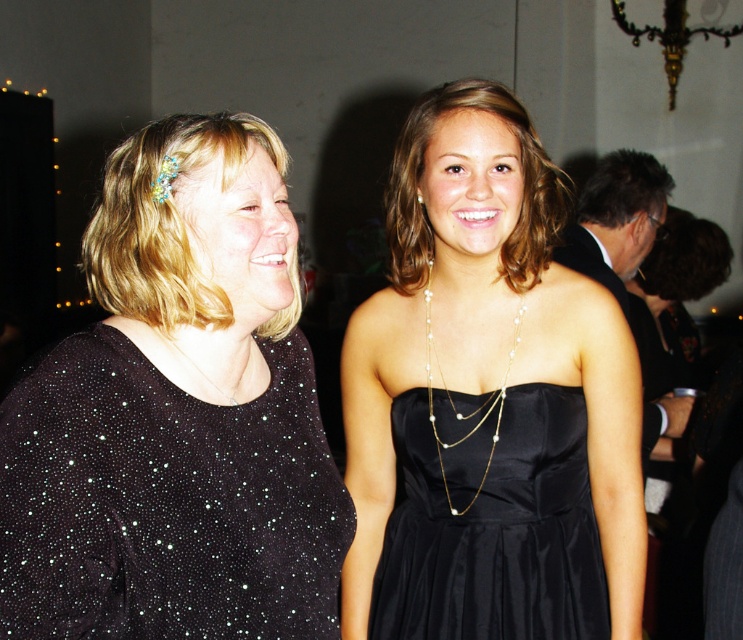
Who is more forward, (406,321) or (464,401)?

Point (464,401) is in front.

Can you confirm if black satin dress at center is shorter than satin black dress at center?

In fact, black satin dress at center may be taller than satin black dress at center.

Find the location of a particular element. black satin dress at center is located at coordinates (489, 401).

Does point (429, 124) come closer to viewer compared to point (181, 353)?

No.

Who is more distant from viewer, (389, 573) or (212, 381)?

The point (389, 573) is more distant.

Who is more distant from viewer, (454, 561) or (171, 340)?

The point (454, 561) is behind.

In order to click on black satin dress at center in this screenshot , I will do `click(489, 401)`.

Does sparkly black dress at center appear on the left side of silver metallic necklace at center?

Correct, you'll find sparkly black dress at center to the left of silver metallic necklace at center.

Between sparkly black dress at center and silver metallic necklace at center, which one is positioned higher?

sparkly black dress at center

At what (x,y) coordinates should I click in order to perform the action: click on sparkly black dress at center. Please return your answer as a coordinate pair (x, y). Looking at the image, I should click on (175, 419).